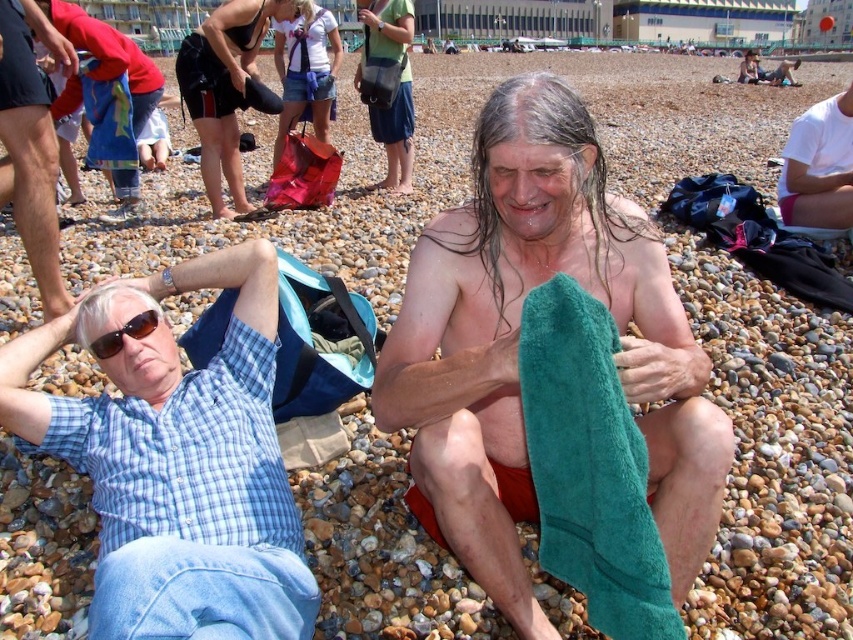
Describe the element at coordinates (517, 344) in the screenshot. I see `green towel at center` at that location.

Who is higher up, green towel at center or blue plaid shirt at upper left?

blue plaid shirt at upper left

What do you see at coordinates (517, 344) in the screenshot?
I see `green towel at center` at bounding box center [517, 344].

Identify the location of green towel at center. This screenshot has width=853, height=640. (517, 344).

Which is more to the left, green towel at center or blue denim shorts at center?

blue denim shorts at center

Between green towel at center and blue denim shorts at center, which one has more height?

blue denim shorts at center

Where is `green towel at center`? green towel at center is located at coordinates (517, 344).

At what (x,y) coordinates should I click in order to perform the action: click on green towel at center. Please return your answer as a coordinate pair (x, y). This screenshot has height=640, width=853. Looking at the image, I should click on (517, 344).

Between blue checkered shirt at upper left and matte black bag at center, which one appears on the left side from the viewer's perspective?

blue checkered shirt at upper left is more to the left.

Is point (109, 582) positioned in front of point (387, 8)?

Yes, it is.

Which is behind, point (15, 433) or point (380, 22)?

The point (380, 22) is more distant.

Locate an element on the screen. The width and height of the screenshot is (853, 640). blue checkered shirt at upper left is located at coordinates (177, 461).